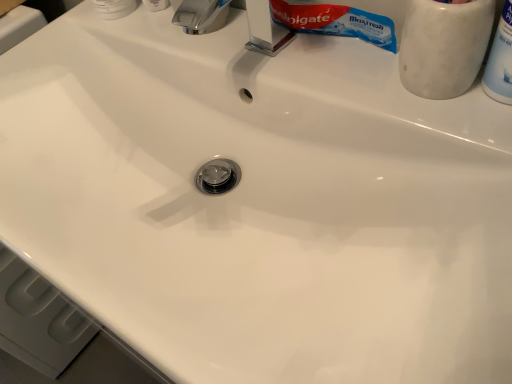
Question: Is white marble toothbrush holder at upper right, acting as the second toiletry starting from the left, bigger than white plastic bottle at upper right, marked as the third toiletry in a left-to-right arrangement?

Choices:
 (A) yes
 (B) no

Answer: (A)

Question: From a real-world perspective, is white marble toothbrush holder at upper right, which ranks as the second toiletry in right-to-left order, positioned over white plastic bottle at upper right, marked as the third toiletry in a left-to-right arrangement, based on gravity?

Choices:
 (A) yes
 (B) no

Answer: (A)

Question: From the image's perspective, is white marble toothbrush holder at upper right, which ranks as the second toiletry in right-to-left order, on top of white plastic bottle at upper right, marked as the third toiletry in a left-to-right arrangement?

Choices:
 (A) no
 (B) yes

Answer: (B)

Question: From a real-world perspective, is white marble toothbrush holder at upper right, which ranks as the second toiletry in right-to-left order, physically below white plastic bottle at upper right, marked as the third toiletry in a left-to-right arrangement?

Choices:
 (A) no
 (B) yes

Answer: (A)

Question: Is white marble toothbrush holder at upper right, which ranks as the second toiletry in right-to-left order, taller than white plastic bottle at upper right, marked as the third toiletry in a left-to-right arrangement?

Choices:
 (A) yes
 (B) no

Answer: (A)

Question: Considering the positions of chrome metallic faucet at upper center and white plastic toothpaste tube at upper left, which ranks as the first toiletry in left-to-right order, in the image, is chrome metallic faucet at upper center wider or thinner than white plastic toothpaste tube at upper left, which ranks as the first toiletry in left-to-right order,?

Choices:
 (A) thin
 (B) wide

Answer: (B)

Question: Is chrome metallic faucet at upper center situated inside white plastic toothpaste tube at upper left, arranged as the 3th toiletry when viewed from the right, or outside?

Choices:
 (A) inside
 (B) outside

Answer: (B)

Question: From the image's perspective, is chrome metallic faucet at upper center positioned above or below white plastic toothpaste tube at upper left, arranged as the 3th toiletry when viewed from the right?

Choices:
 (A) below
 (B) above

Answer: (A)

Question: Is point (268, 54) closer or farther from the camera than point (108, 18)?

Choices:
 (A) farther
 (B) closer

Answer: (B)

Question: From the image's perspective, is white plastic bottle at upper right, marked as the third toiletry in a left-to-right arrangement, positioned above or below white marble toothbrush holder at upper right, acting as the second toiletry starting from the left?

Choices:
 (A) below
 (B) above

Answer: (A)

Question: In terms of width, does white plastic bottle at upper right, which is counted as the first toiletry, starting from the right, look wider or thinner when compared to white marble toothbrush holder at upper right, acting as the second toiletry starting from the left?

Choices:
 (A) thin
 (B) wide

Answer: (A)

Question: Which is correct: white plastic bottle at upper right, marked as the third toiletry in a left-to-right arrangement, is inside white marble toothbrush holder at upper right, acting as the second toiletry starting from the left, or outside of it?

Choices:
 (A) inside
 (B) outside

Answer: (B)

Question: Would you say white plastic bottle at upper right, which is counted as the first toiletry, starting from the right, is to the left or to the right of white marble toothbrush holder at upper right, which ranks as the second toiletry in right-to-left order, in the picture?

Choices:
 (A) right
 (B) left

Answer: (A)

Question: Considering the positions of chrome metallic faucet at upper center and white plastic bottle at upper right, which is counted as the first toiletry, starting from the right, in the image, is chrome metallic faucet at upper center bigger or smaller than white plastic bottle at upper right, which is counted as the first toiletry, starting from the right,?

Choices:
 (A) small
 (B) big

Answer: (B)

Question: From the image's perspective, relative to white plastic bottle at upper right, which is counted as the first toiletry, starting from the right, is chrome metallic faucet at upper center above or below?

Choices:
 (A) below
 (B) above

Answer: (B)